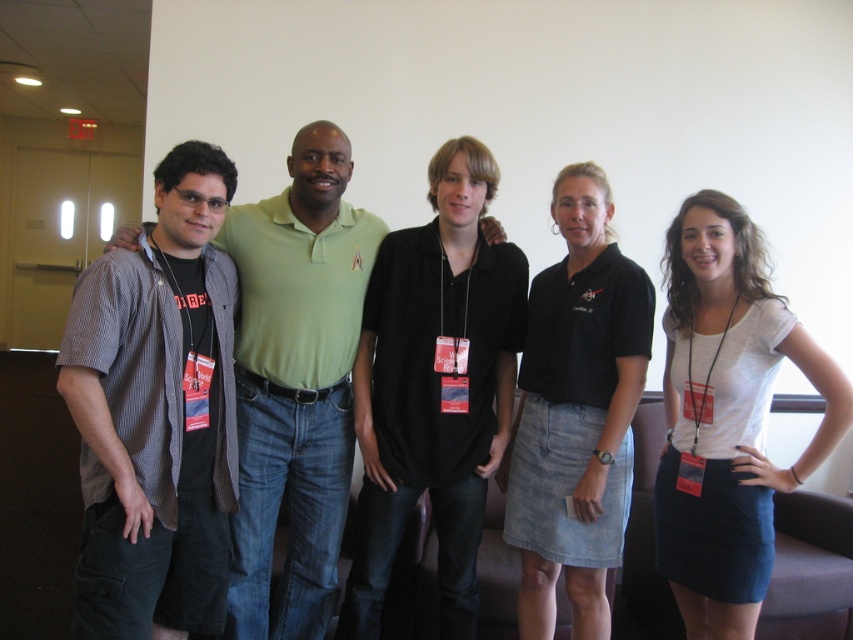
Question: Does white cotton shirt at center appear under black denim skirt at center?

Choices:
 (A) no
 (B) yes

Answer: (B)

Question: Can you confirm if checkered fabric shirt at center is positioned to the right of white cotton shirt at center?

Choices:
 (A) no
 (B) yes

Answer: (A)

Question: Based on their relative distances, which object is nearer to the white cotton shirt at center?

Choices:
 (A) black denim skirt at center
 (B) checkered fabric shirt at center

Answer: (A)

Question: Considering the relative positions of checkered fabric shirt at left and white cotton shirt at center in the image provided, where is checkered fabric shirt at left located with respect to white cotton shirt at center?

Choices:
 (A) above
 (B) below

Answer: (A)

Question: Which is nearer to the black denim skirt at center?

Choices:
 (A) checkered fabric shirt at center
 (B) checkered fabric shirt at left
 (C) white cotton shirt at center

Answer: (C)

Question: Which object is closer to the camera taking this photo?

Choices:
 (A) black cotton shirt at center
 (B) checkered fabric shirt at center

Answer: (B)